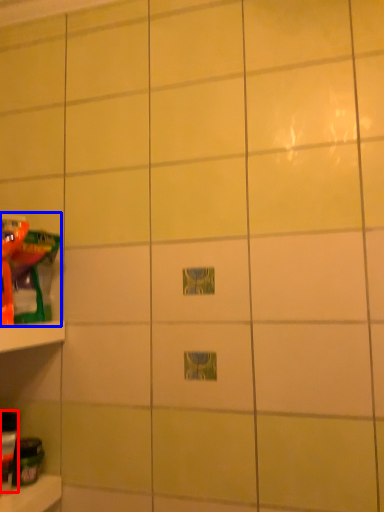
Question: Which point is closer to the camera, toy (highlighted by a red box) or toy (highlighted by a blue box)?

Choices:
 (A) toy
 (B) toy

Answer: (A)